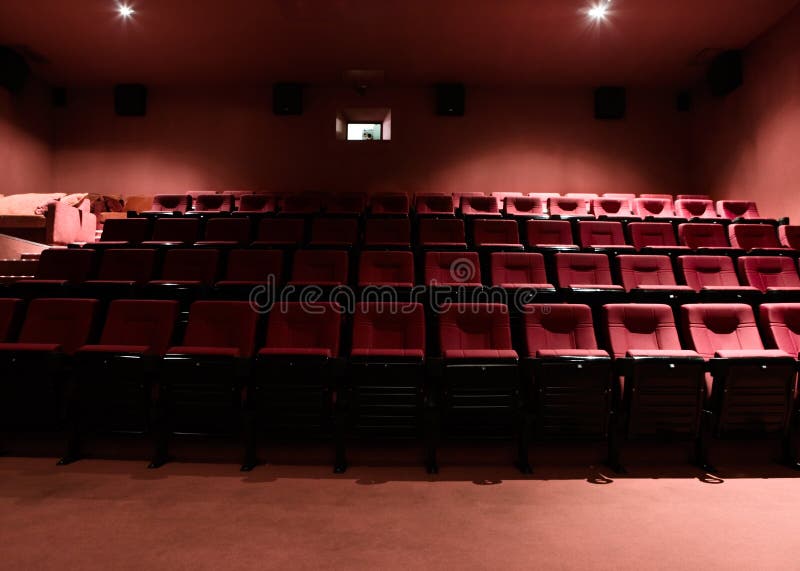
Where is `speakers`? speakers is located at coordinates (20, 66), (56, 96), (116, 96), (288, 100), (448, 100), (612, 100), (686, 98), (725, 81).